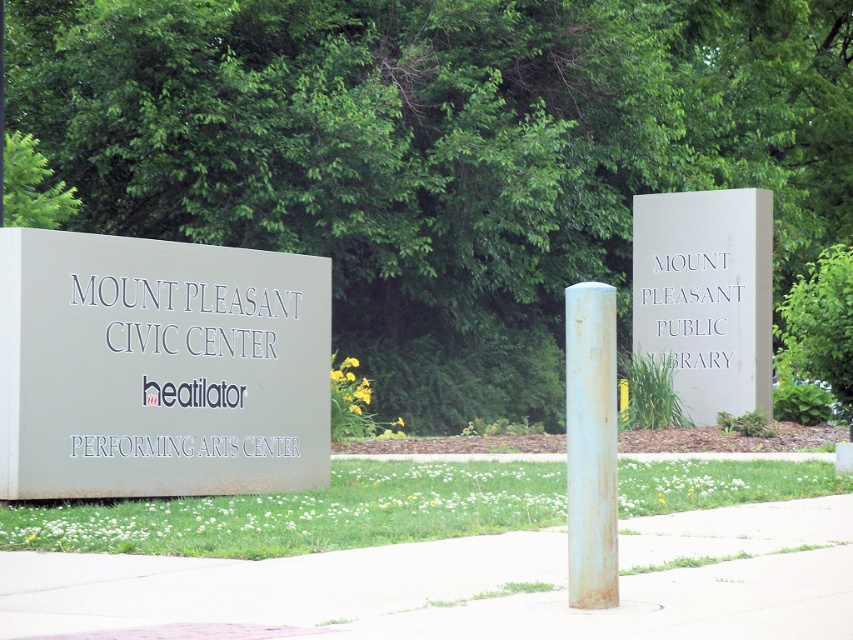
Question: Which is nearer to the matte gray sign at left?

Choices:
 (A) rusty metal pole at center
 (B) white stone sign at center

Answer: (A)

Question: Where is white stone sign at center located in relation to rusty metal pole at center in the image?

Choices:
 (A) left
 (B) right

Answer: (B)

Question: Which point is farther to the camera?

Choices:
 (A) white stone sign at center
 (B) matte gray sign at left
 (C) rusty metal pole at center

Answer: (A)

Question: Does matte gray sign at left have a smaller size compared to white stone sign at center?

Choices:
 (A) yes
 (B) no

Answer: (B)

Question: Which object appears closest to the camera in this image?

Choices:
 (A) rusty metal pole at center
 (B) matte gray sign at left

Answer: (A)

Question: Is matte gray sign at left above rusty metal pole at center?

Choices:
 (A) no
 (B) yes

Answer: (B)